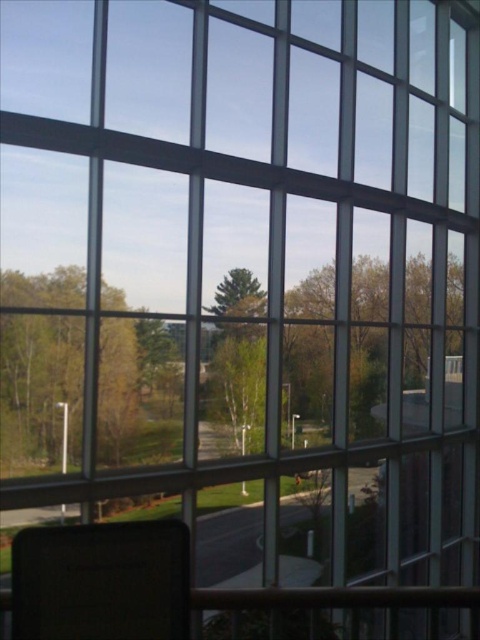
Is point (109, 532) in front of point (255, 289)?

Yes.

In the scene shown: Can you confirm if matte black chair at lower left is thinner than green matte tree at center?

Yes.

Is point (12, 572) closer to camera compared to point (249, 280)?

Yes, it is in front of point (249, 280).

The width and height of the screenshot is (480, 640). I want to click on matte black chair at lower left, so click(101, 580).